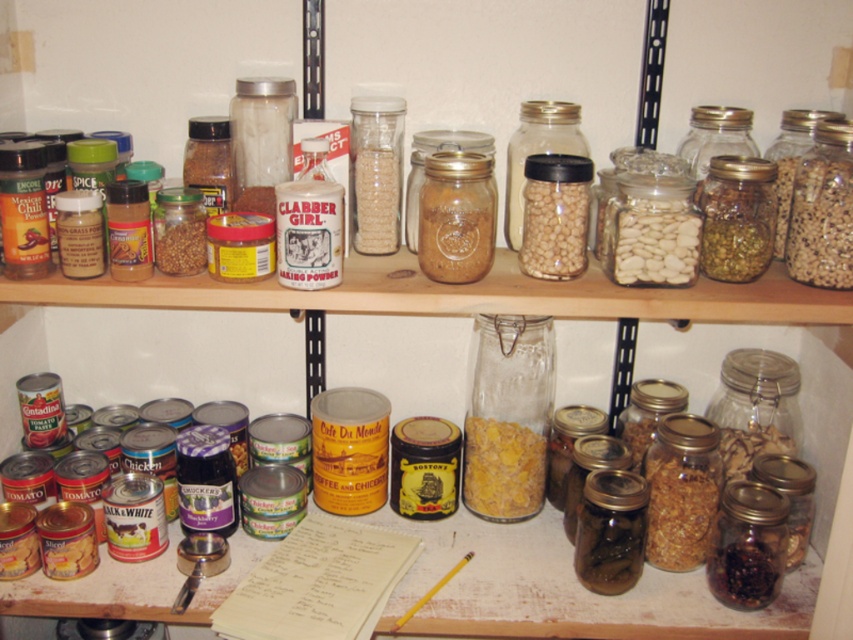
Between clear glass jar at center and white matte beans at center, which one appears on the left side from the viewer's perspective?

Positioned to the left is clear glass jar at center.

Does point (480, 369) come behind point (688, 273)?

Yes, it is.

The image size is (853, 640). Describe the element at coordinates (508, 417) in the screenshot. I see `clear glass jar at center` at that location.

Where is `clear glass jar at center`? clear glass jar at center is located at coordinates (508, 417).

Is white matte beans at center positioned behind yellow matte corn at center?

No, white matte beans at center is in front of yellow matte corn at center.

Does white matte beans at center appear on the right side of yellow matte corn at center?

Yes, white matte beans at center is to the right of yellow matte corn at center.

Is point (612, 232) behind point (531, 452)?

No, it is not.

Find the location of a particular element. white matte beans at center is located at coordinates (653, 241).

Is yellow matte corn at center wider than brown granular at lower right?

Correct, the width of yellow matte corn at center exceeds that of brown granular at lower right.

At what (x,y) coordinates should I click in order to perform the action: click on yellow matte corn at center. Please return your answer as a coordinate pair (x, y). Looking at the image, I should click on (502, 468).

Where is `yellow matte corn at center`? The width and height of the screenshot is (853, 640). yellow matte corn at center is located at coordinates (502, 468).